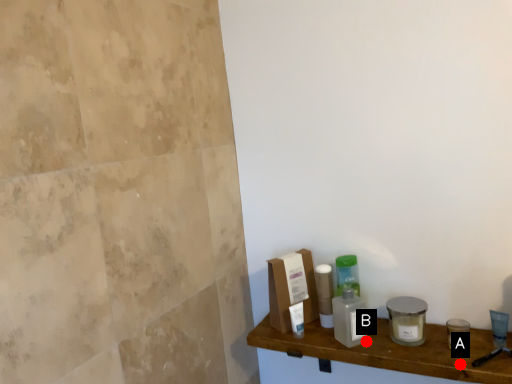
Question: Two points are circled on the image, labeled by A and B beside each circle. Which point appears closest to the camera in this image?

Choices:
 (A) A is closer
 (B) B is closer

Answer: (A)